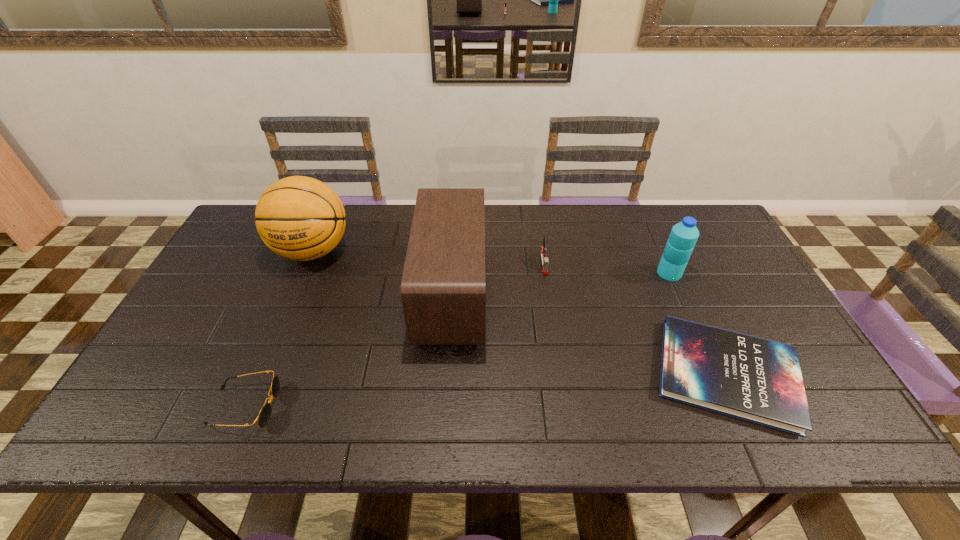
This screenshot has width=960, height=540. Identify the location of vacant point located on the handle side of the stapler. (563, 386).

You are a GUI agent. You are given a task and a screenshot of the screen. Output one action in this format:
    pyautogui.click(x=<x>, y=<y>)
    Task: Click on the free space located 0.340m on the front-facing side of the sunglasses
    
    Given the screenshot: What is the action you would take?
    pyautogui.click(x=426, y=407)

Find the location of a particular element. vacant space located on the left of the hardback book is located at coordinates (498, 374).

This screenshot has height=540, width=960. Identify the location of basketball situated at the far edge. 300,218.

Where is `radio receiver at the far edge`? radio receiver at the far edge is located at coordinates (443, 284).

This screenshot has height=540, width=960. What are the coordinates of `sunglasses that is positioned at the near edge` in the screenshot? It's located at (264, 415).

Find the location of a particular element. This screenshot has width=960, height=540. hardback book that is at the near edge is located at coordinates (758, 380).

Image resolution: width=960 pixels, height=540 pixels. In order to click on object that is at the left edge in this screenshot , I will do `click(300, 218)`.

The image size is (960, 540). What are the coordinates of `object that is at the right edge` in the screenshot? It's located at (758, 380).

The height and width of the screenshot is (540, 960). I want to click on object situated at the far left corner, so click(300, 218).